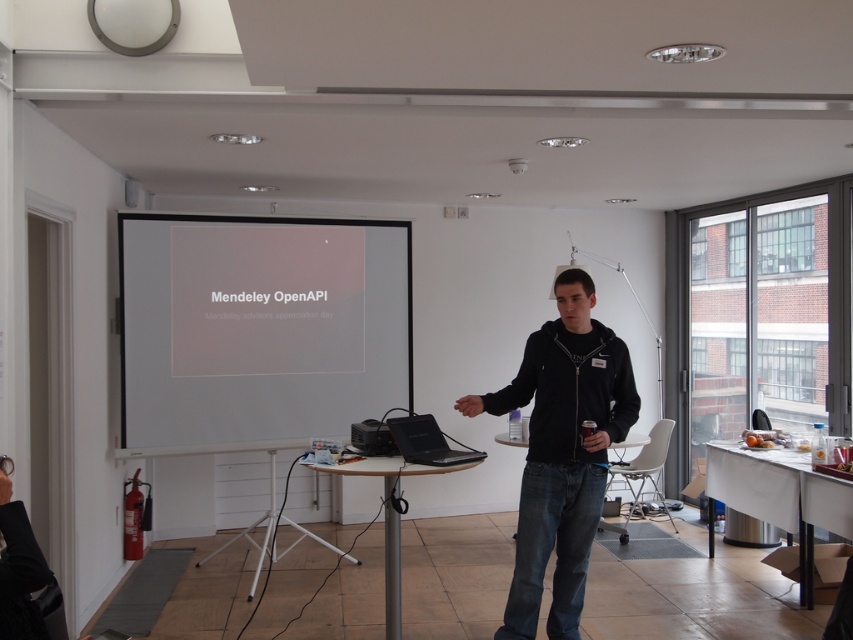
Question: Which object is the closest to the black matte jacket at center?

Choices:
 (A) white matte projection screen at center
 (B) black plastic projector at center

Answer: (B)

Question: Where is black matte jacket at center located in relation to black plastic projector at center in the image?

Choices:
 (A) above
 (B) below

Answer: (B)

Question: Which object appears farthest from the camera in this image?

Choices:
 (A) black matte jacket at center
 (B) white matte projection screen at center
 (C) black plastic projector at center

Answer: (B)

Question: Is white matte projection screen at center further to the viewer compared to black matte jacket at center?

Choices:
 (A) no
 (B) yes

Answer: (B)

Question: Which point is closer to the camera?

Choices:
 (A) (527, 602)
 (B) (282, 273)
 (C) (384, 424)

Answer: (A)

Question: Where is black matte jacket at center located in relation to black plastic projector at center in the image?

Choices:
 (A) left
 (B) right

Answer: (B)